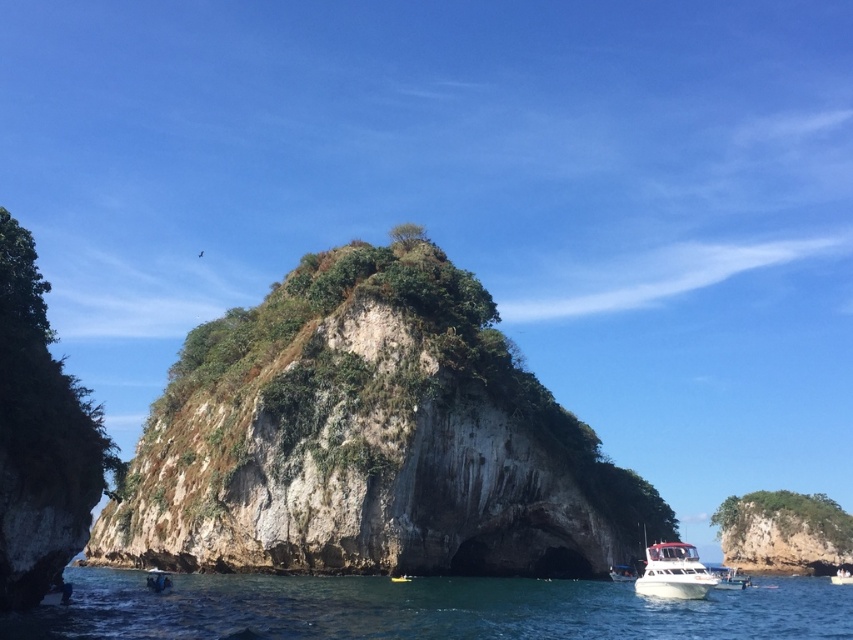
Question: Among these objects, which one is nearest to the camera?

Choices:
 (A) clear blue water at lower center
 (B) white glossy boat at lower center

Answer: (A)

Question: Is clear blue water at lower center positioned before white glossy boat at lower center?

Choices:
 (A) yes
 (B) no

Answer: (A)

Question: Can you confirm if rough stone cliff at center is smaller than clear blue water at lower center?

Choices:
 (A) no
 (B) yes

Answer: (B)

Question: Is the position of rough stone cliff at center more distant than that of clear blue water at lower center?

Choices:
 (A) no
 (B) yes

Answer: (B)

Question: Among these points, which one is nearest to the camera?

Choices:
 (A) (138, 436)
 (B) (387, 612)

Answer: (B)

Question: Estimate the real-world distances between objects in this image. Which object is farther from the clear blue water at lower center?

Choices:
 (A) white glossy boat at lower center
 (B) rough stone cliff at center

Answer: (A)